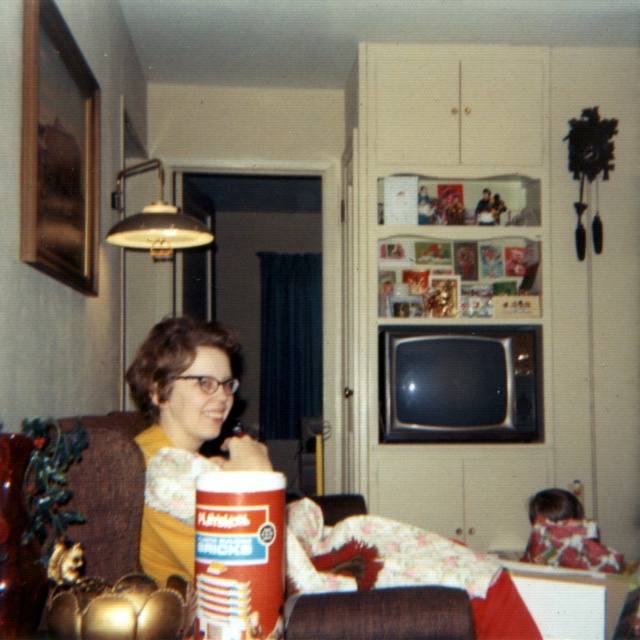
Is matte yellow blouse at left wider than brown cardboard can at lower center?

Yes.

Where is `matte yellow blouse at left`? This screenshot has height=640, width=640. matte yellow blouse at left is located at coordinates (182, 432).